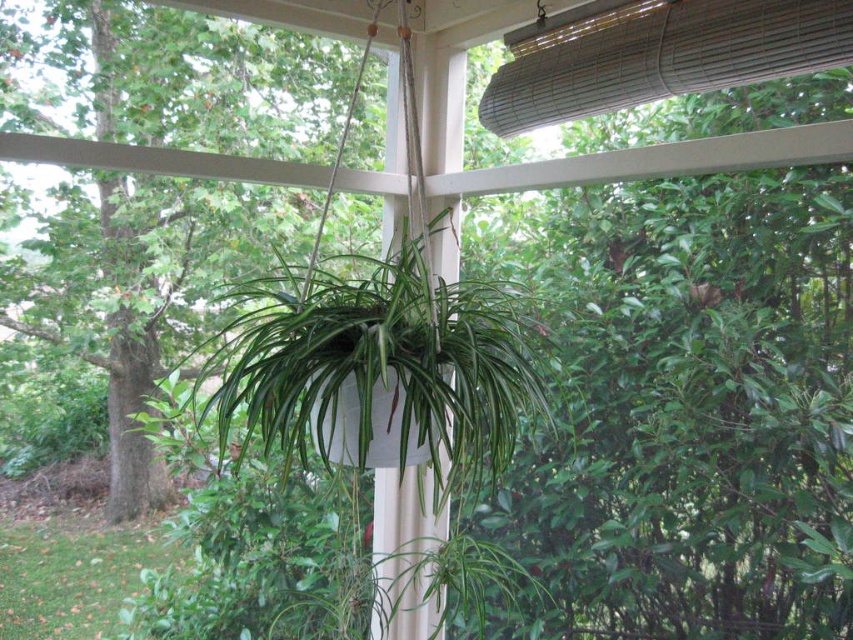
Which is more to the left, green leafy tree at center or bamboo blind at upper center?

green leafy tree at center

Is point (209, 186) farther from viewer compared to point (787, 65)?

Yes, point (209, 186) is farther from viewer.

Find the location of `green leafy tree at center`. green leafy tree at center is located at coordinates (142, 289).

Is green leafy tree at center taller than green matte hanging plant at center?

Yes.

Between green leafy tree at center and green matte hanging plant at center, which one has less height?

With less height is green matte hanging plant at center.

Locate an element on the screen. This screenshot has width=853, height=640. green leafy tree at center is located at coordinates (142, 289).

Locate an element on the screen. This screenshot has height=640, width=853. green leafy tree at center is located at coordinates (142, 289).

Can you confirm if green matte hanging plant at center is smaller than bamboo blind at upper center?

Actually, green matte hanging plant at center might be larger than bamboo blind at upper center.

Does green matte hanging plant at center have a lesser width compared to bamboo blind at upper center?

Incorrect, green matte hanging plant at center's width is not less than bamboo blind at upper center's.

Does point (403, 244) lie in front of point (515, 106)?

Yes, point (403, 244) is closer to viewer.

Where is `green matte hanging plant at center`? The image size is (853, 640). green matte hanging plant at center is located at coordinates (378, 368).